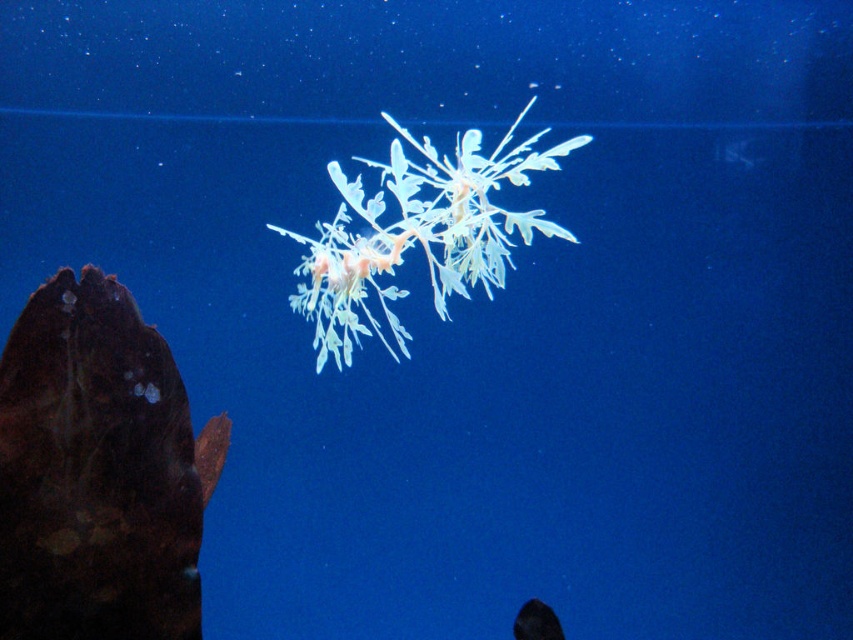
Question: Which object appears farthest from the camera in this image?

Choices:
 (A) brown matte fish at left
 (B) translucent white leaf at center

Answer: (A)

Question: Does brown matte fish at left come in front of translucent white leaf at center?

Choices:
 (A) yes
 (B) no

Answer: (B)

Question: Among these objects, which one is nearest to the camera?

Choices:
 (A) translucent white leaf at center
 (B) brown matte fish at left

Answer: (A)

Question: Is brown matte fish at left thinner than translucent white leaf at center?

Choices:
 (A) no
 (B) yes

Answer: (B)

Question: Among these points, which one is farthest from the camera?

Choices:
 (A) tap(469, 275)
 (B) tap(55, 627)

Answer: (A)

Question: Can you confirm if brown matte fish at left is positioned to the left of translucent white leaf at center?

Choices:
 (A) no
 (B) yes

Answer: (B)